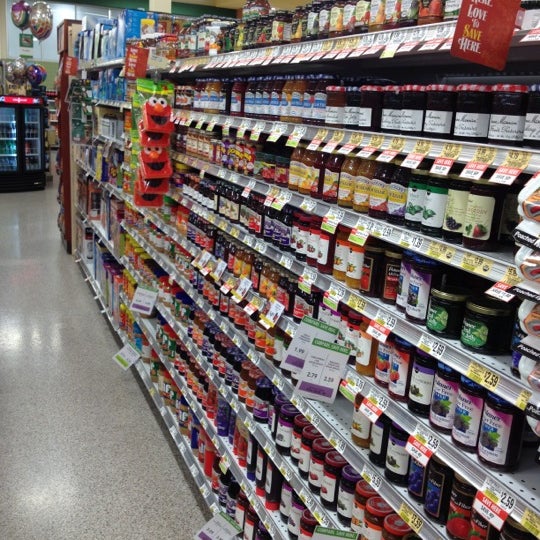
The height and width of the screenshot is (540, 540). Identify the location of floor. (108, 453).